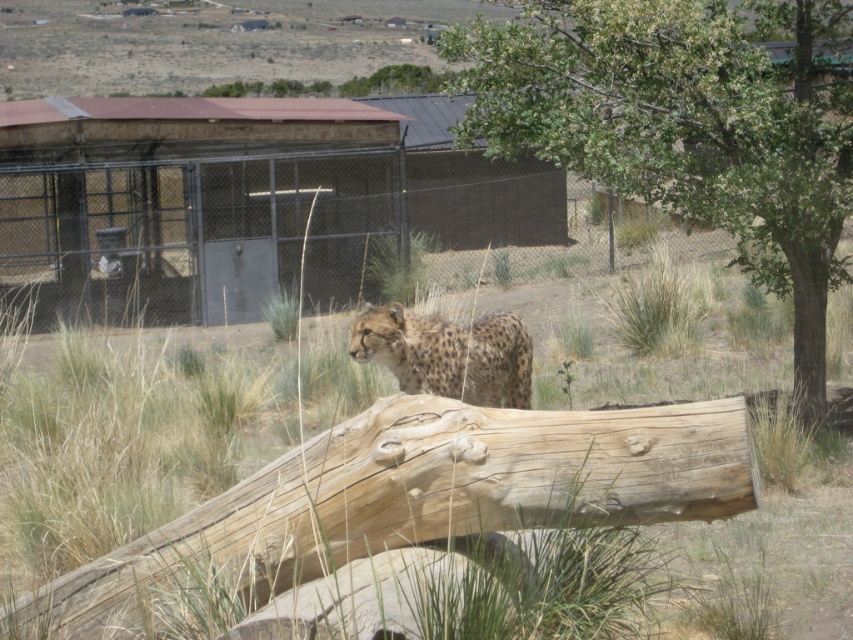
Question: Is green grass at center to the right of spotted fur cheetah at center from the viewer's perspective?

Choices:
 (A) yes
 (B) no

Answer: (B)

Question: Is green grass at center to the left of spotted fur cheetah at center from the viewer's perspective?

Choices:
 (A) yes
 (B) no

Answer: (A)

Question: Which is nearer to the green leafy tree at upper right?

Choices:
 (A) green grass at center
 (B) spotted fur cheetah at center

Answer: (B)

Question: Which object appears farthest from the camera in this image?

Choices:
 (A) green leafy tree at upper right
 (B) green grass at center
 (C) spotted fur cheetah at center

Answer: (A)

Question: Can you confirm if green leafy tree at upper right is smaller than spotted fur cheetah at center?

Choices:
 (A) yes
 (B) no

Answer: (A)

Question: Which point appears farthest from the camera in this image?

Choices:
 (A) (830, 275)
 (B) (265, 364)
 (C) (471, 392)

Answer: (B)